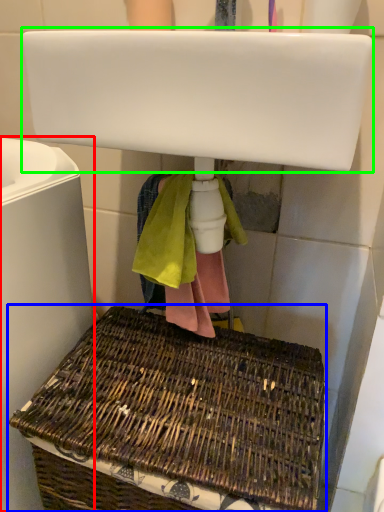
Question: Which object is the farthest from bath (highlighted by a red box)? Choose among these: picnic basket (highlighted by a blue box) or sink (highlighted by a green box).

Choices:
 (A) picnic basket
 (B) sink

Answer: (B)